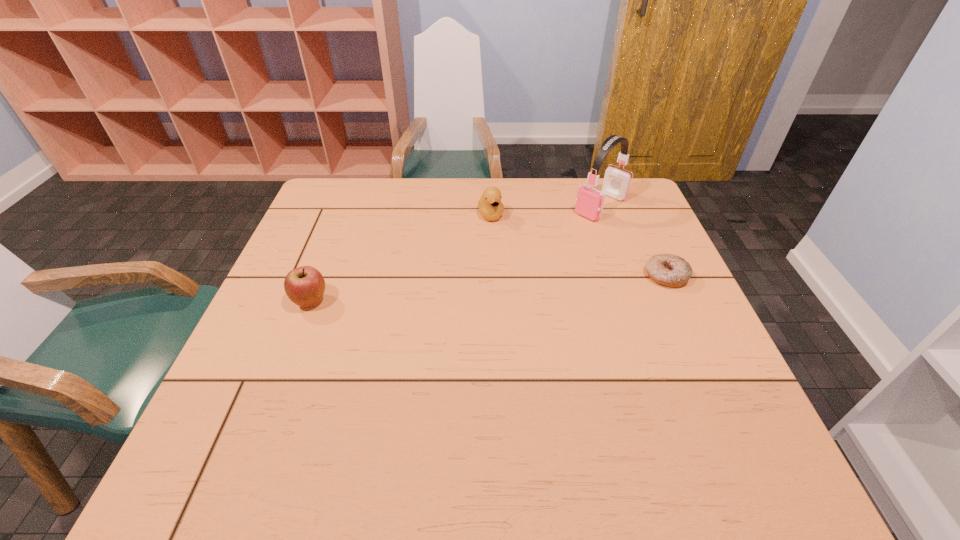
Find the location of a particular element. This screenshot has width=960, height=540. apple is located at coordinates (304, 286).

In order to click on the shortest object in this screenshot , I will do `click(670, 270)`.

This screenshot has height=540, width=960. What are the coordinates of `duckling` in the screenshot? It's located at (491, 208).

Locate an element on the screen. The width and height of the screenshot is (960, 540). earphone is located at coordinates (589, 203).

The width and height of the screenshot is (960, 540). Identify the location of vacant area situated 0.160m on the back of the leftmost object. (331, 248).

Where is `free space located on the left of the shortest object`? free space located on the left of the shortest object is located at coordinates (496, 276).

Locate an element on the screen. free location located 0.170m on the face of the third object from right to left is located at coordinates (508, 263).

Locate an element on the screen. Image resolution: width=960 pixels, height=540 pixels. vacant region located on the face of the third object from right to left is located at coordinates (505, 256).

At what (x,y) coordinates should I click in order to perform the action: click on free space located 0.300m on the face of the third object from right to left. Please return your answer as a coordinate pair (x, y). Looking at the image, I should click on (521, 298).

The height and width of the screenshot is (540, 960). Identify the location of vacant space located on the outer surface of the earphone. [x=500, y=283].